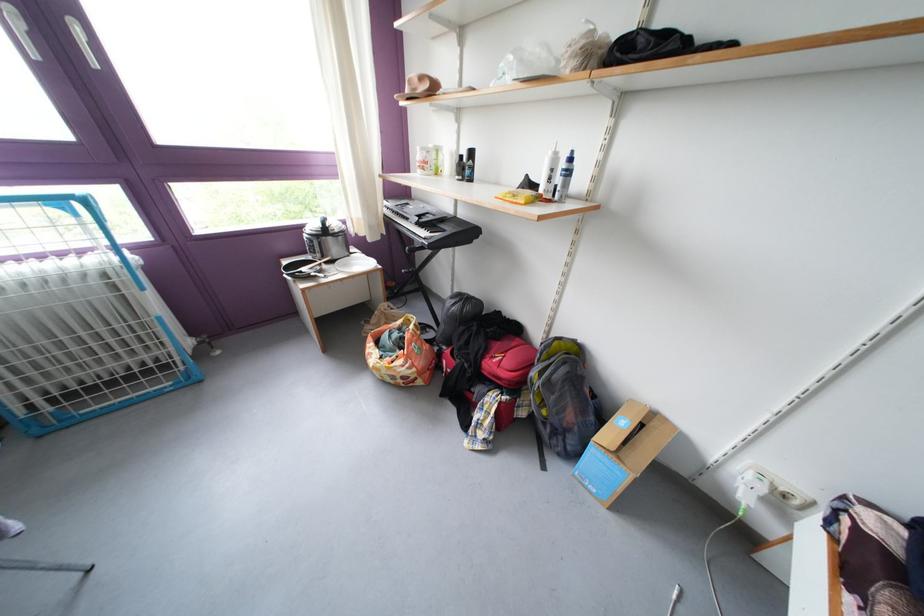
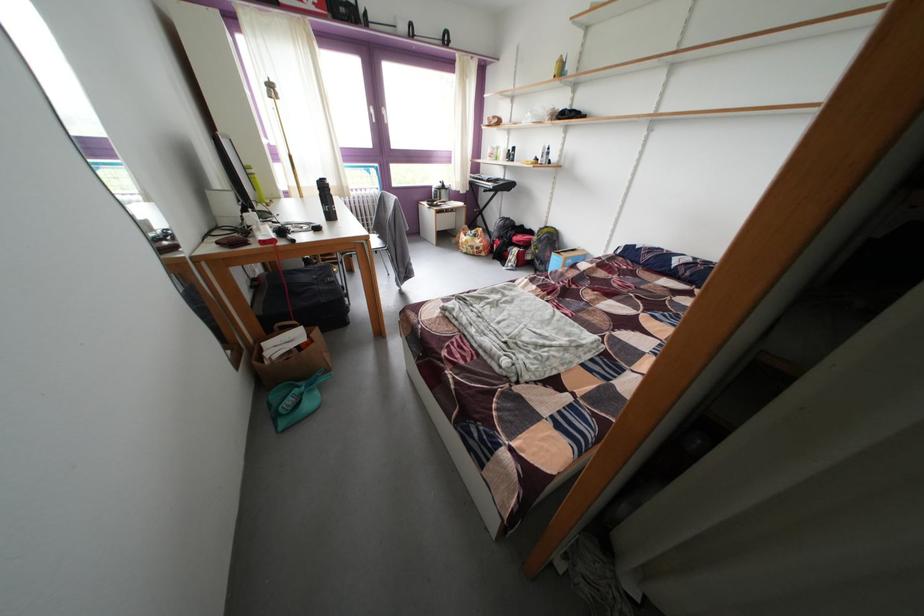
Question: I am providing you with two images of the same scene from different viewpoints. Which of the following objects are not visible in image2?

Choices:
 (A) pink pamphlet
 (B) red backpack
 (C) black water bottle
 (D) yellow bottle

Answer: (B)